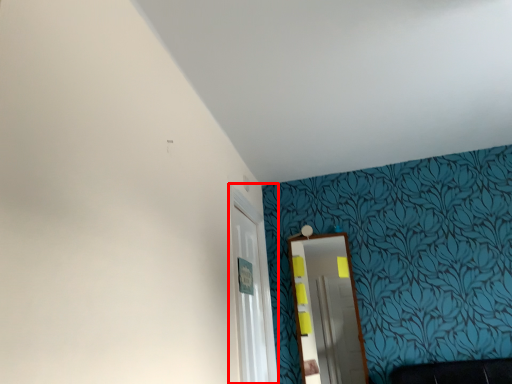
Question: In this image, where is glass door (annotated by the red box) located relative to mirror?

Choices:
 (A) left
 (B) right

Answer: (A)